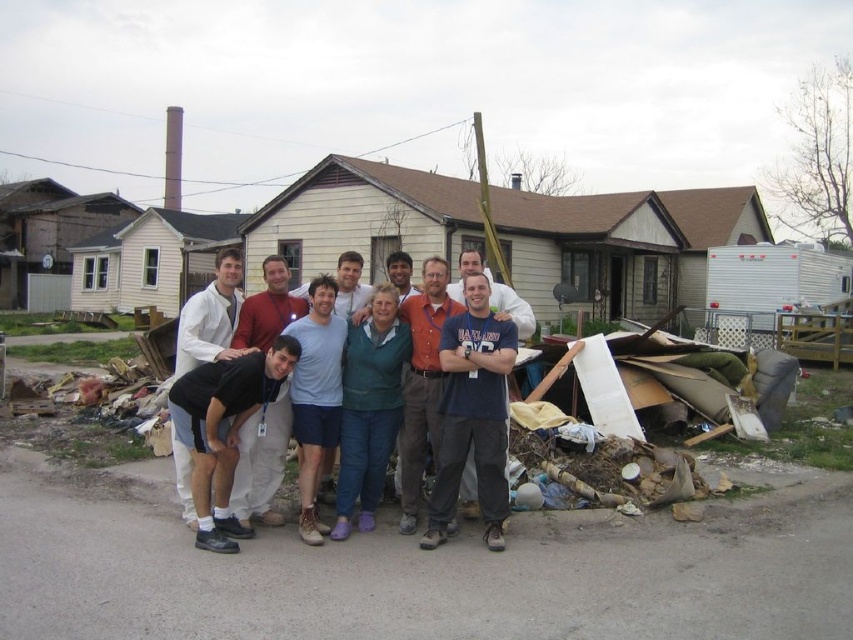
Question: Is matte white shirt at center to the left of black fabric at center from the viewer's perspective?

Choices:
 (A) no
 (B) yes

Answer: (A)

Question: Where is matte white shirt at center located in relation to black fabric at center in the image?

Choices:
 (A) above
 (B) below

Answer: (A)

Question: Which point is closer to the camera?

Choices:
 (A) black fabric at center
 (B) matte white shirt at center

Answer: (A)

Question: Which point is farther from the camera taking this photo?

Choices:
 (A) (234, 499)
 (B) (202, 456)

Answer: (A)

Question: Does matte white shirt at center lie behind black fabric at center?

Choices:
 (A) yes
 (B) no

Answer: (A)

Question: Which of the following is the closest to the observer?

Choices:
 (A) (183, 387)
 (B) (238, 388)

Answer: (B)